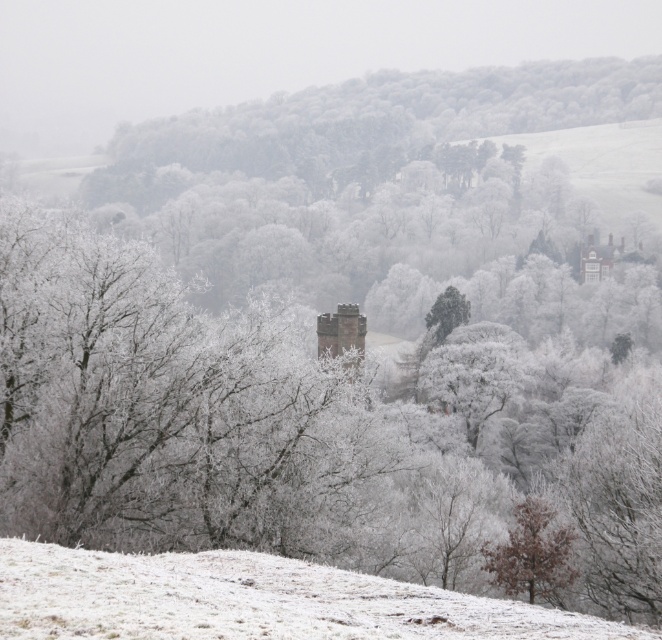
Based on the coordinates provided, where exactly is the frosted white trees at center located in the image?

The frosted white trees at center are located at the 2D coordinates point (369, 124).

You are a drone operator tasked with capturing aerial footage of the frosted white trees at center and the brown stone chimney at center. The drone has a maximum flight range of 200 meters. Can the drone safely fly between these two points without exceeding its range?

The frosted white trees at center and the brown stone chimney at center are 186.64 meters apart from each other. Since the drone has a maximum flight range of 200 meters, it can safely fly between them without exceeding its range.

You are standing in the winter landscape and want to walk from the point closer to you to the point further away. Which path would you take between the two points, point (132, 179) and point (355, 346)?

You should walk from point (132, 179) to point (355, 346) because point (132, 179) is closer to you and point (355, 346) is further away.